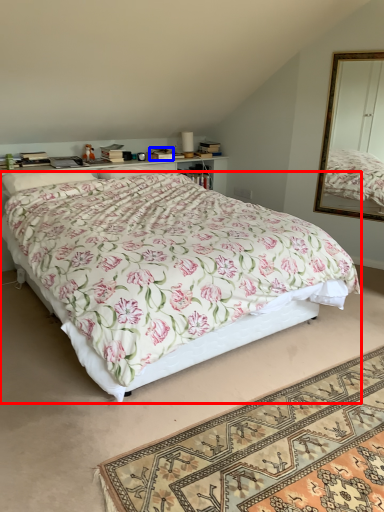
Question: Which object appears farthest to the camera in this image, bed (highlighted by a red box) or box (highlighted by a blue box)?

Choices:
 (A) bed
 (B) box

Answer: (B)